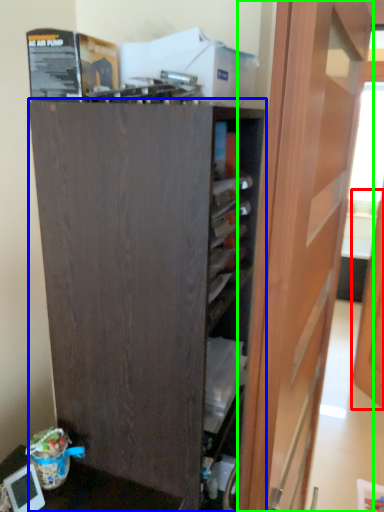
Question: Which object is positioned farthest from door (highlighted by a red box)? Select from cupboard (highlighted by a blue box) and door (highlighted by a green box).

Choices:
 (A) cupboard
 (B) door

Answer: (A)